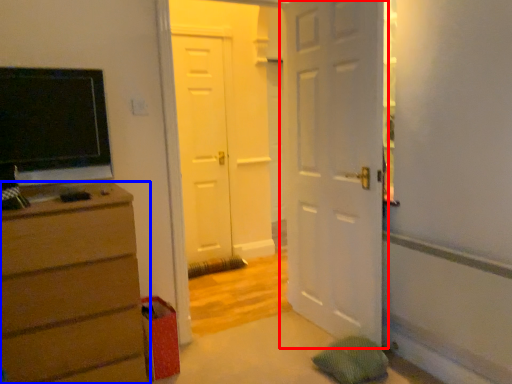
Question: Which object is closer to the camera taking this photo, door (highlighted by a red box) or chest of drawers (highlighted by a blue box)?

Choices:
 (A) door
 (B) chest of drawers

Answer: (B)